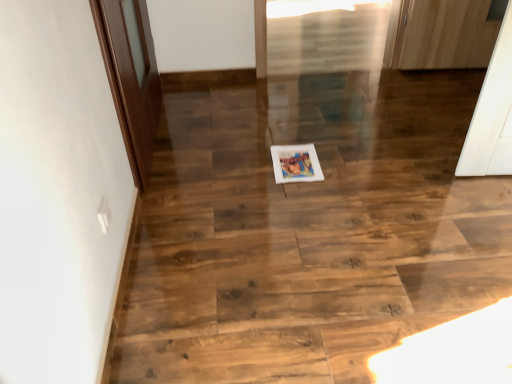
Identify the location of empty space that is to the right of matte paper postcard at center. (342, 162).